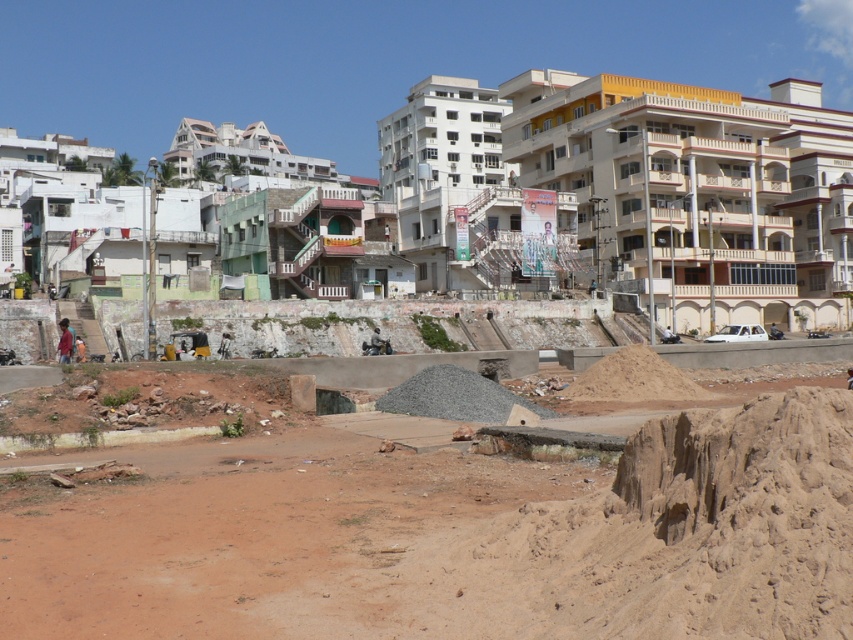
Is brown sandy dirt field at lower center wider than brown sandy mound at center?

Yes.

Does point (842, 632) come in front of point (660, 387)?

That is True.

Does point (682, 449) come behind point (648, 348)?

No.

You are a GUI agent. You are given a task and a screenshot of the screen. Output one action in this format:
    pyautogui.click(x=<x>, y=<y>)
    Task: Click on the brown sandy dirt field at lower center
    
    Given the screenshot: What is the action you would take?
    pyautogui.click(x=457, y=544)

Identify the location of gray gravel pile at center. (454, 396).

What do you see at coordinates (454, 396) in the screenshot? I see `gray gravel pile at center` at bounding box center [454, 396].

Who is more forward, (491, 380) or (607, 387)?

Point (607, 387) is in front.

Where is `gray gravel pile at center`? Image resolution: width=853 pixels, height=640 pixels. gray gravel pile at center is located at coordinates (454, 396).

The image size is (853, 640). What are the coordinates of `brown sandy dirt field at lower center` in the screenshot? It's located at (457, 544).

This screenshot has width=853, height=640. What do you see at coordinates (457, 544) in the screenshot?
I see `brown sandy dirt field at lower center` at bounding box center [457, 544].

Describe the element at coordinates (457, 544) in the screenshot. I see `brown sandy dirt field at lower center` at that location.

Where is `brown sandy dirt field at lower center`? The image size is (853, 640). brown sandy dirt field at lower center is located at coordinates (457, 544).